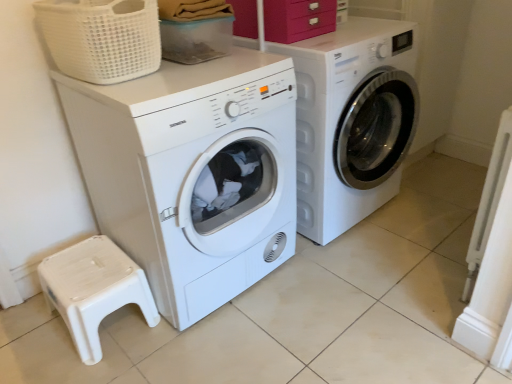
At what (x,y) coordinates should I click in order to perform the action: click on free space in front of white plastic step stool at lower left. Please return your answer as a coordinate pair (x, y). Looking at the image, I should click on (88, 368).